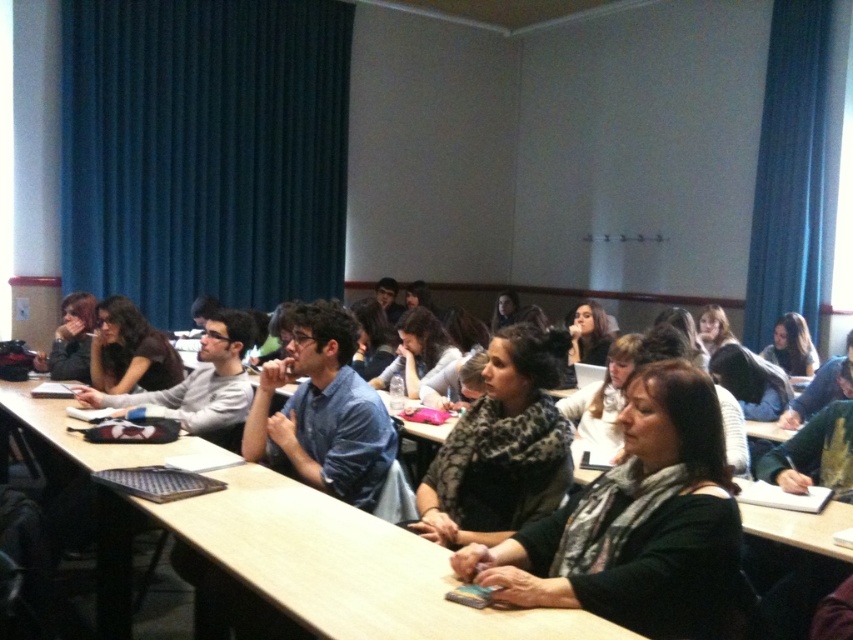
Question: Can you confirm if wooden table at center is smaller than black matte scarf at center?

Choices:
 (A) yes
 (B) no

Answer: (B)

Question: Which object is the closest to the dark gray scarf at center?

Choices:
 (A) wooden table at center
 (B) blue fabric curtain at upper left
 (C) blue fabric curtain at upper right

Answer: (A)

Question: Is black matte scarf at center further to camera compared to matte black shirt at center?

Choices:
 (A) no
 (B) yes

Answer: (A)

Question: Is black matte scarf at center to the right of matte black shirt at center from the viewer's perspective?

Choices:
 (A) yes
 (B) no

Answer: (A)

Question: Which point appears farthest from the camera in this image?

Choices:
 (A) coord(822,3)
 (B) coord(718,630)
 (C) coord(161,458)
 (D) coord(445,547)

Answer: (A)

Question: Considering the real-world distances, which object is closest to the blue fabric curtain at upper right?

Choices:
 (A) black matte scarf at center
 (B) wooden table at center
 (C) matte black shirt at center

Answer: (C)